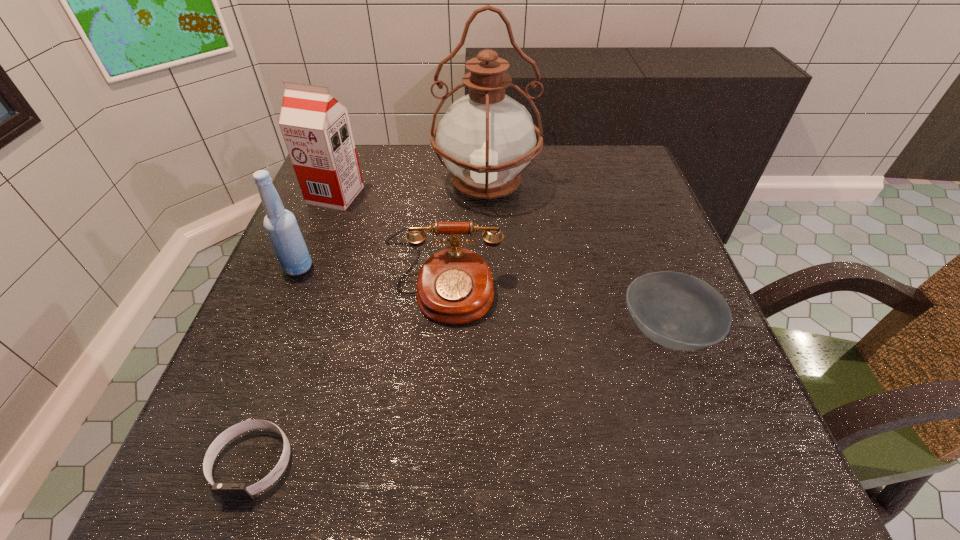
Where is `object that is at the far left corner`? The image size is (960, 540). object that is at the far left corner is located at coordinates (316, 128).

Identify the location of object located at the near left corner. (227, 491).

In the image, there is a desktop. Identify the location of vacant space at the far edge. (411, 164).

This screenshot has height=540, width=960. In order to click on vacant space at the near edge of the desktop in this screenshot , I will do `click(613, 477)`.

Identify the location of vacant space at the left edge of the desktop. This screenshot has height=540, width=960. (252, 357).

The height and width of the screenshot is (540, 960). In the image, there is a desktop. In order to click on vacant space at the right edge in this screenshot , I will do `click(612, 200)`.

Locate an element on the screen. vacant space at the far right corner is located at coordinates (597, 178).

At what (x,y) coordinates should I click in order to perform the action: click on free space between the shortest object and the fifth shortest object. Please return your answer as a coordinate pair (x, y). The height and width of the screenshot is (540, 960). Looking at the image, I should click on (294, 329).

Where is `free spot between the tallest object and the bottle`? This screenshot has width=960, height=540. free spot between the tallest object and the bottle is located at coordinates (392, 226).

The height and width of the screenshot is (540, 960). Find the location of `free space between the bottle and the shortest object`. free space between the bottle and the shortest object is located at coordinates (276, 364).